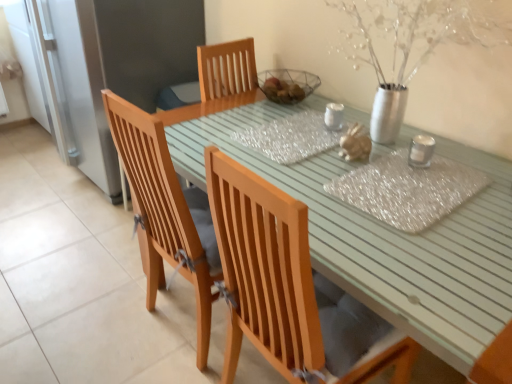
Where is `free space in front of clear plastic placemat at center`? free space in front of clear plastic placemat at center is located at coordinates (429, 256).